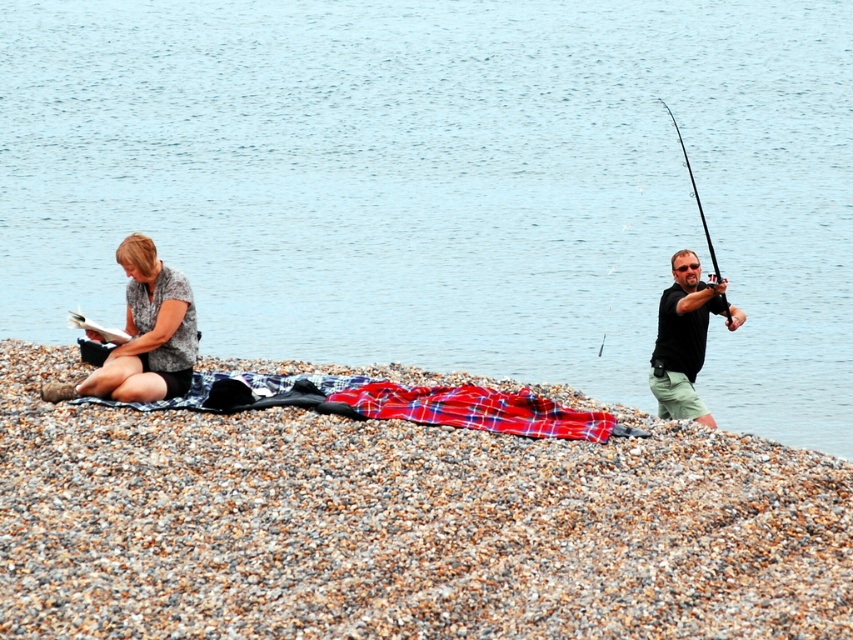
You are a photographer standing on the beach. You want to take a picture of the blue water at center and the black plastic rod at right. Which object is positioned higher in the frame?

The blue water at center is positioned higher in the frame than the black plastic rod at right.

You are standing on the pebble beach and want to reach the blue water at center without getting your shoes wet. There is a black plastic rod at right in your way. Which object should you move first to create a clear path?

You should move the black plastic rod at right first because the blue water at center is closer to the viewer, so the black plastic rod at right is blocking the path between you and the water.

What are the coordinates of the blue water at center in the image?

The blue water at center is located at coordinates point (445, 184).